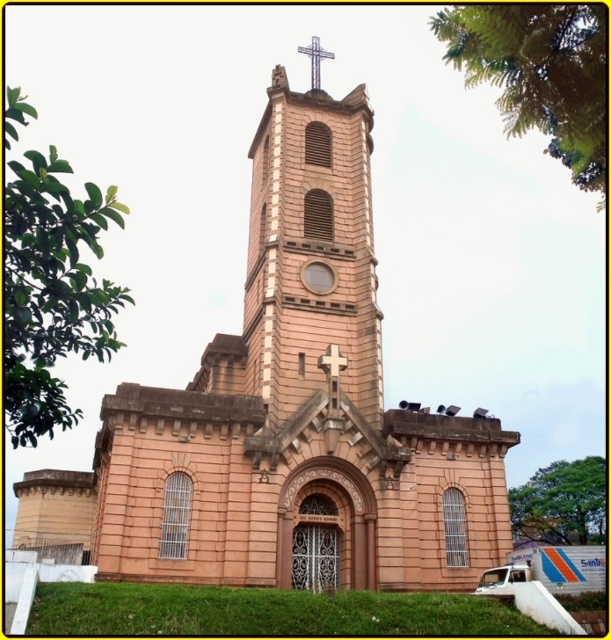
Question: Which of the following is the closest to the observer?

Choices:
 (A) matte brown clock at center
 (B) pink stone bell tower at center
 (C) wooden cross at center
 (D) white metallic cross at upper center

Answer: (B)

Question: Is pink stone bell tower at center to the right of wooden cross at center from the viewer's perspective?

Choices:
 (A) no
 (B) yes

Answer: (A)

Question: Can you confirm if pink stone church at center is positioned below matte brown clock at center?

Choices:
 (A) no
 (B) yes

Answer: (B)

Question: Is pink stone church at center thinner than white metallic cross at upper center?

Choices:
 (A) yes
 (B) no

Answer: (B)

Question: Which is nearer to the pink stone church at center?

Choices:
 (A) white metallic cross at upper center
 (B) pink stone bell tower at center
 (C) wooden cross at center

Answer: (B)

Question: Considering the real-world distances, which object is closest to the wooden cross at center?

Choices:
 (A) pink stone bell tower at center
 (B) matte brown clock at center
 (C) white metallic cross at upper center

Answer: (B)